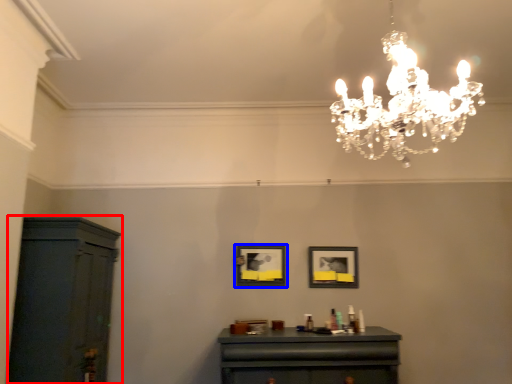
Question: Which of the following is the closest to the observer, cabinetry (highlighted by a red box) or picture frame (highlighted by a blue box)?

Choices:
 (A) cabinetry
 (B) picture frame

Answer: (A)